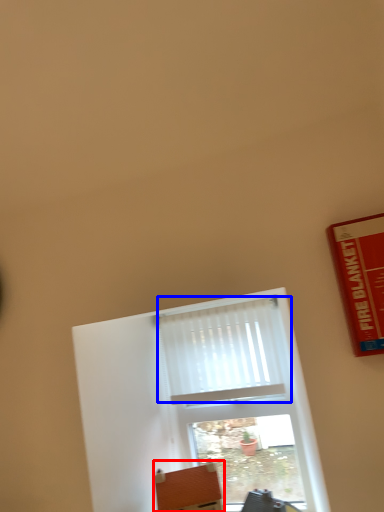
Question: Among these objects, which one is farthest to the camera, furniture (highlighted by a red box) or curtain (highlighted by a blue box)?

Choices:
 (A) furniture
 (B) curtain

Answer: (B)